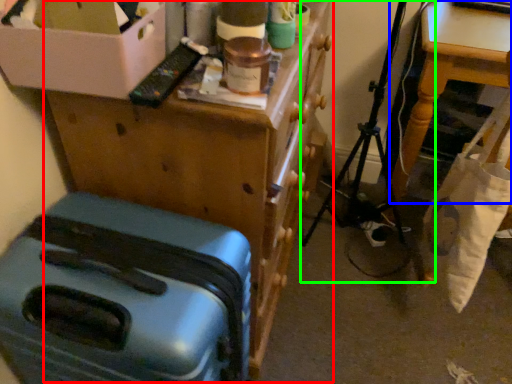
Question: Considering the real-world distances, which object is closest to furniture (highlighted by a red box)? table (highlighted by a blue box) or folding chair (highlighted by a green box).

Choices:
 (A) table
 (B) folding chair

Answer: (A)